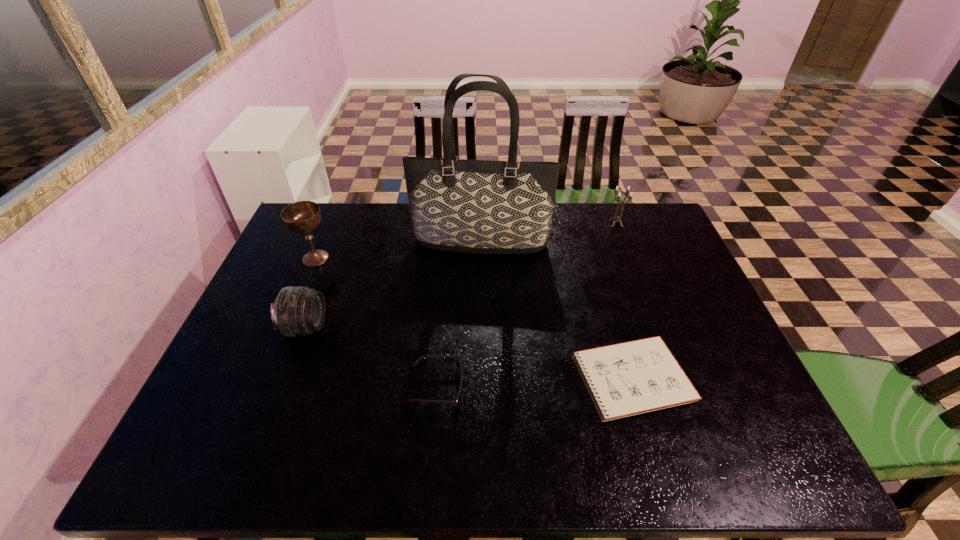
Identify the location of the tallest object. (471, 206).

At what (x,y) coordinates should I click in order to perform the action: click on the second tallest object. Please return your answer as a coordinate pair (x, y). The height and width of the screenshot is (540, 960). Looking at the image, I should click on (304, 216).

Find the location of a particular element. This screenshot has width=960, height=540. the farthest object is located at coordinates (617, 218).

Find the location of `telephoto lens`. telephoto lens is located at coordinates (297, 310).

Identify the location of sunglasses. The image size is (960, 540). (458, 366).

This screenshot has width=960, height=540. Find the location of `the shortest object`. the shortest object is located at coordinates (631, 378).

Image resolution: width=960 pixels, height=540 pixels. What are the coordinates of `vacant position located 0.280m on the right of the tallest object` in the screenshot? It's located at (636, 243).

Locate an element on the screen. free space located on the right of the chalice is located at coordinates (348, 258).

I want to click on blank area located 0.390m on the front of the farthest object, so click(651, 314).

Locate an element on the screen. vacant point located 0.170m at the front element of the telephoto lens is located at coordinates (389, 327).